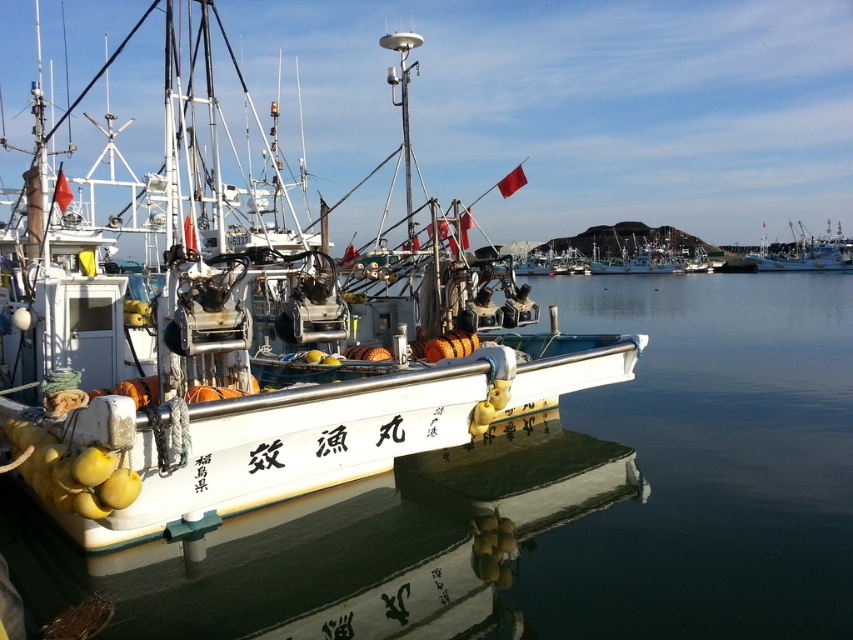
Who is positioned more to the left, white glossy water at center or white matte boat at right?

white glossy water at center

Is white glossy water at center taller than white matte boat at right?

No.

The height and width of the screenshot is (640, 853). What do you see at coordinates (549, 500) in the screenshot?
I see `white glossy water at center` at bounding box center [549, 500].

The width and height of the screenshot is (853, 640). Find the location of `white glossy water at center`. white glossy water at center is located at coordinates [549, 500].

Is point (421, 464) positioned behind point (287, 417)?

Yes.

Does white glossy water at center lie behind white matte boat at center?

Yes.

Is point (450, 548) farther from camera compared to point (271, 392)?

Yes.

This screenshot has height=640, width=853. Find the location of `white glossy water at center`. white glossy water at center is located at coordinates (549, 500).

Find the location of a particular element. white matte boat at center is located at coordinates (241, 349).

Is white matte boat at center bigger than white matte boat at right?

Yes.

I want to click on white matte boat at center, so click(x=241, y=349).

In order to click on white matte boat at center in this screenshot , I will do `click(241, 349)`.